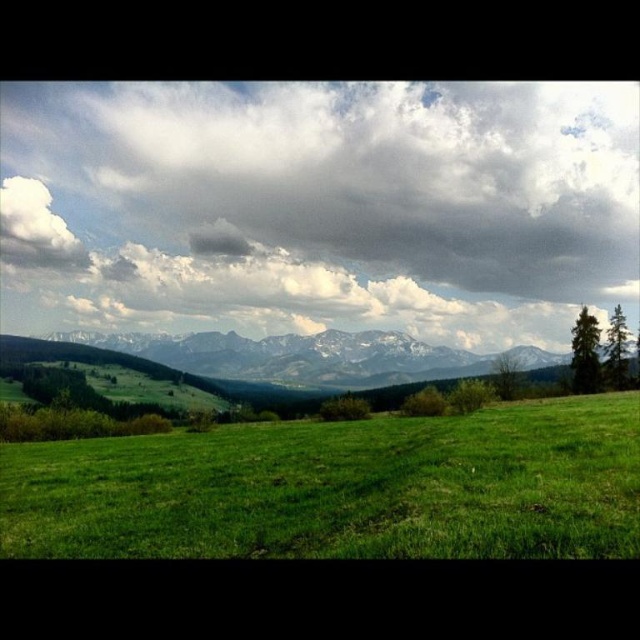
Is green grassy field at lower center taller than white fluffy cloud at upper left?

No, green grassy field at lower center is not taller than white fluffy cloud at upper left.

Between green grassy field at lower center and white fluffy cloud at upper left, which one appears on the left side from the viewer's perspective?

white fluffy cloud at upper left

Is point (212, 465) closer to camera compared to point (12, 205)?

That is True.

Identify the location of green grassy field at lower center. The height and width of the screenshot is (640, 640). (340, 486).

Between cloudy sky at upper center and white snow-covered mountain range at center, which one is positioned higher?

cloudy sky at upper center is above.

Is cloudy sky at upper center closer to the viewer compared to white snow-covered mountain range at center?

No, it is not.

Where is `cloudy sky at upper center`? The width and height of the screenshot is (640, 640). cloudy sky at upper center is located at coordinates (384, 180).

The image size is (640, 640). I want to click on cloudy sky at upper center, so click(x=384, y=180).

Can you confirm if cloudy sky at upper center is positioned to the right of green grassy field at lower center?

Correct, you'll find cloudy sky at upper center to the right of green grassy field at lower center.

Image resolution: width=640 pixels, height=640 pixels. Describe the element at coordinates (384, 180) in the screenshot. I see `cloudy sky at upper center` at that location.

Where is `cloudy sky at upper center`? Image resolution: width=640 pixels, height=640 pixels. cloudy sky at upper center is located at coordinates (384, 180).